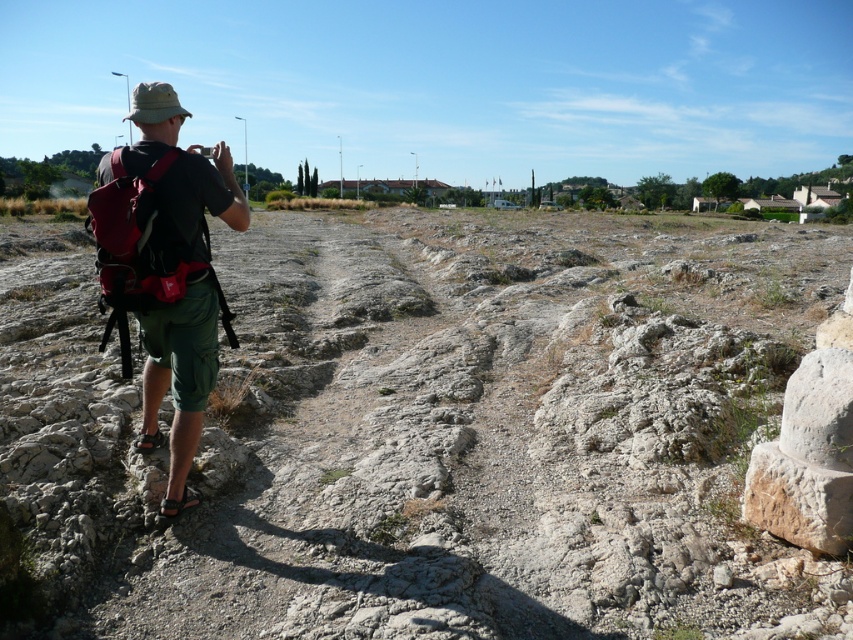
Question: Which point is farther from the camera taking this photo?

Choices:
 (A) (184, 280)
 (B) (653, 497)

Answer: (B)

Question: Which point is farther to the camera?

Choices:
 (A) matte red backpack at left
 (B) gray rocky terrain at center

Answer: (A)

Question: Can you confirm if green fabric shorts at left is bigger than matte red backpack at left?

Choices:
 (A) no
 (B) yes

Answer: (B)

Question: Is green fabric shorts at left to the left of matte red backpack at left from the viewer's perspective?

Choices:
 (A) no
 (B) yes

Answer: (A)

Question: Does gray rocky terrain at center appear over green fabric shorts at left?

Choices:
 (A) no
 (B) yes

Answer: (B)

Question: Among these objects, which one is nearest to the camera?

Choices:
 (A) matte red backpack at left
 (B) gray rocky terrain at center

Answer: (B)